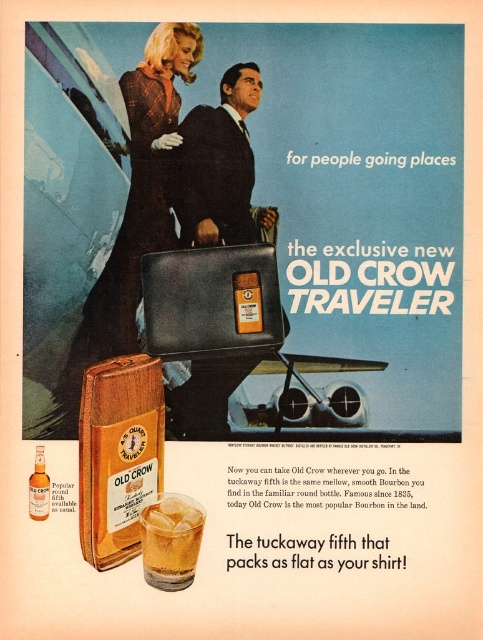
Between point (193, 417) and point (208, 186), which one is positioned behind?

Positioned behind is point (193, 417).

Is matte black briefcase at center thinner than smooth leather jacket at center?

No, matte black briefcase at center is not thinner than smooth leather jacket at center.

You are a GUI agent. You are given a task and a screenshot of the screen. Output one action in this format:
    pyautogui.click(x=<x>, y=<y>)
    Task: Click on the matte black briefcase at center
    This screenshot has height=640, width=483.
    Given the screenshot: What is the action you would take?
    pyautogui.click(x=221, y=166)

Locate an element on the screen. The width and height of the screenshot is (483, 640). matte black briefcase at center is located at coordinates (221, 166).

Can you confirm if matte black briefcase at center is positioned to the left of amber liquid glass at lower center?

In fact, matte black briefcase at center is to the right of amber liquid glass at lower center.

Is matte black briefcase at center smaller than amber liquid glass at lower center?

Actually, matte black briefcase at center might be larger than amber liquid glass at lower center.

What do you see at coordinates (221, 166) in the screenshot? I see `matte black briefcase at center` at bounding box center [221, 166].

Identify the location of matte black briefcase at center. This screenshot has width=483, height=640. (221, 166).

Does point (209, 170) come farther from viewer compared to point (30, 506)?

Yes.

Looking at this image, between smooth leather jacket at center and amber glass bottle at lower left, which one appears on the right side from the viewer's perspective?

From the viewer's perspective, smooth leather jacket at center appears more on the right side.

Does point (226, 188) come behind point (34, 490)?

Yes, it is behind point (34, 490).

Locate an element on the screen. smooth leather jacket at center is located at coordinates (219, 166).